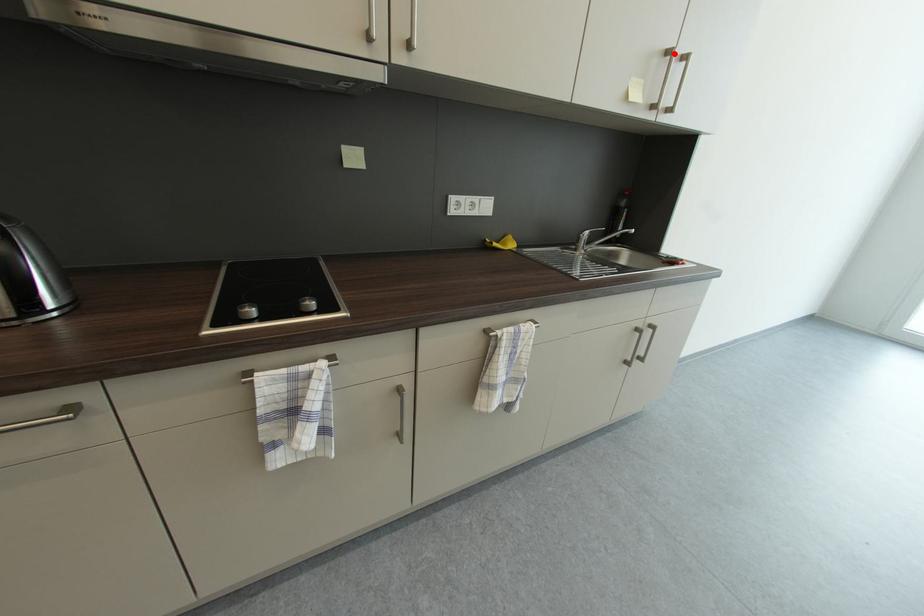
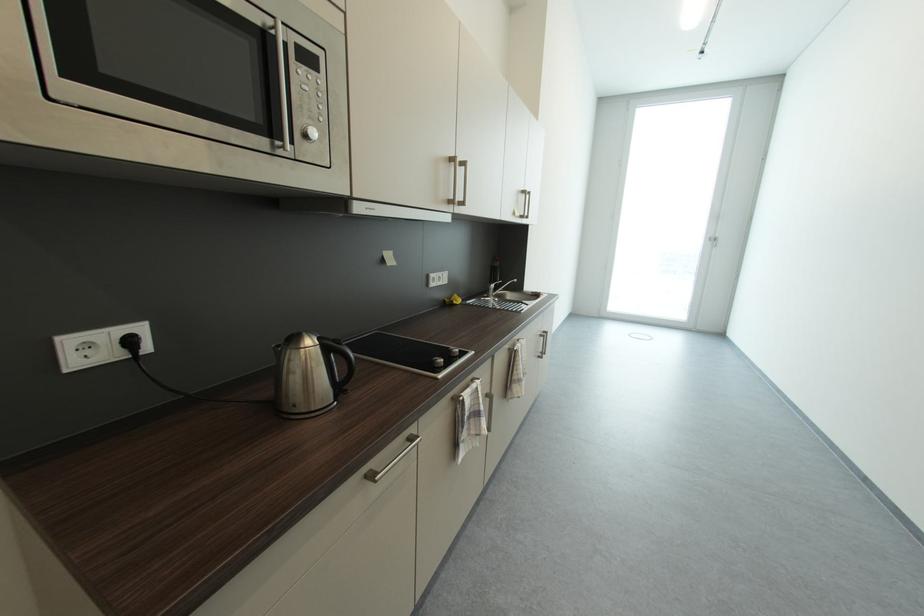
Question: A red point is marked in image1. In image2, is the corresponding 3D point closer to the camera or farther? Reply with the corresponding letter.

Choices:
 (A) The corresponding 3D point is closer.
 (B) The corresponding 3D point is farther.

Answer: (A)